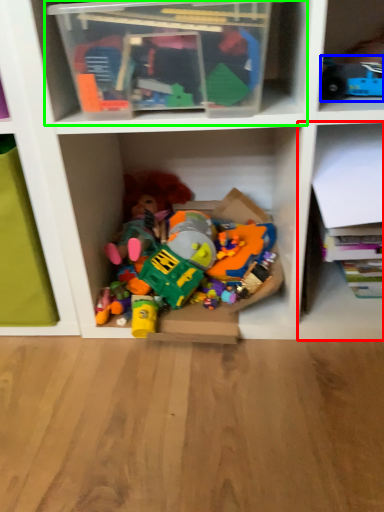
Question: Considering the real-world distances, which object is closest to shelf (highlighted by a red box)? toy (highlighted by a blue box) or shelf (highlighted by a green box).

Choices:
 (A) toy
 (B) shelf

Answer: (A)